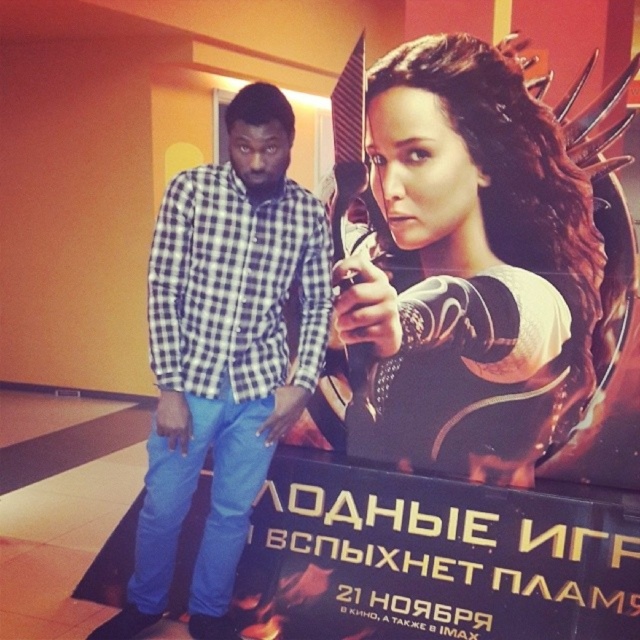
You are a costume designer trying to decide whether the shiny black armor at center can fit over the checkered fabric shirt at center. Based on their sizes, can the armor accommodate the shirt?

The shiny black armor at center is wider than the checkered fabric shirt at center, so the armor can accommodate the shirt.

You are a costume designer working on a historical drama. You need to determine which item is shorter between the shiny black armor at center and the checkered fabric shirt at center. Which one should you choose for a character that needs a shorter costume?

The shiny black armor at center is not as tall as the checkered fabric shirt at center, so you should choose the shiny black armor at center for the character that needs a shorter costume.